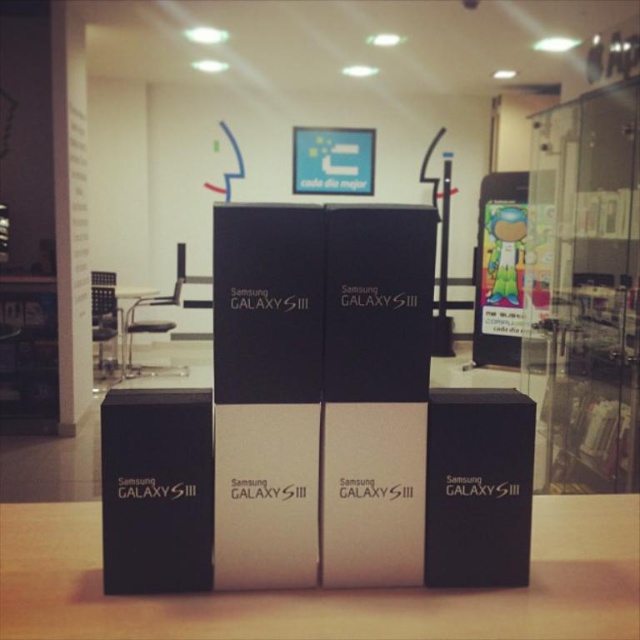
You are setting up a display for a product launch. You have a metallic silver table at left and black matte galaxy s iii boxes at center. Based on the scene, which object takes up more space?

The metallic silver table at left takes up more space than the black matte galaxy s iii boxes at center because the black matte galaxy s iii boxes at center occupies less space than metallic silver table at left.

In the scene shown: You are standing in front of the Samsung Galaxy S III display pyramid. There are two points marked on the boxes. The first point is at coordinates point (563, 529) and the second is at point (154, 291). Which point is closer to you?

Point (563, 529) is closer to the camera than point (154, 291), so the first point is closer to you.

You are setting up a display for an electronics store and need to place the black matte galaxy s iii boxes at center on the metallic silver table at left. Based on their sizes, will the boxes fit entirely on the table without overhanging the edges?

The black matte galaxy s iii boxes at center might be wider than metallic silver table at left, so there is a possibility that the boxes will overhang the edges of the table. Check the exact dimensions before placing them.